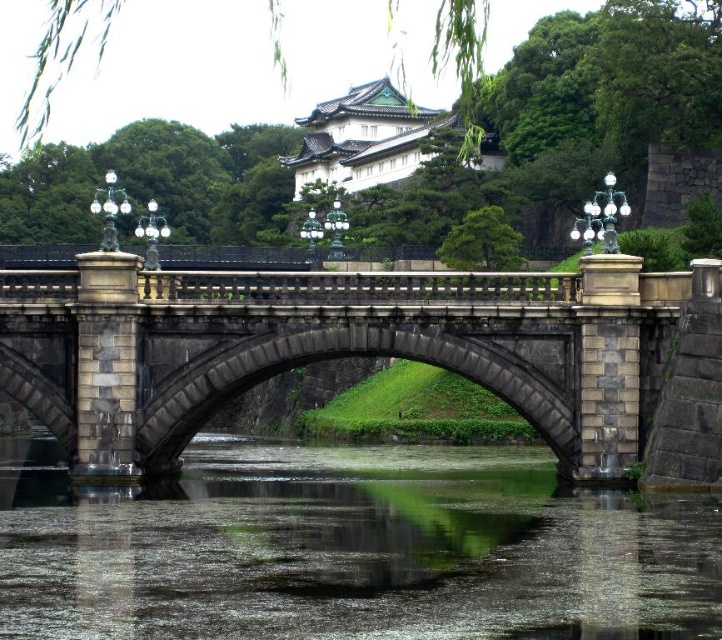
Is green algae-covered water at center positioned in front of stone bridge at center?

That is True.

Does green algae-covered water at center have a lesser height compared to stone bridge at center?

Indeed, green algae-covered water at center has a lesser height compared to stone bridge at center.

What do you see at coordinates (352, 548) in the screenshot? This screenshot has width=722, height=640. I see `green algae-covered water at center` at bounding box center [352, 548].

I want to click on green algae-covered water at center, so click(352, 548).